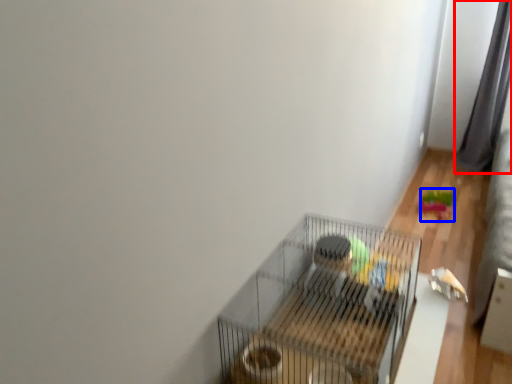
Question: Which object appears closest to the camera in this image, curtain (highlighted by a red box) or toy (highlighted by a blue box)?

Choices:
 (A) curtain
 (B) toy

Answer: (B)